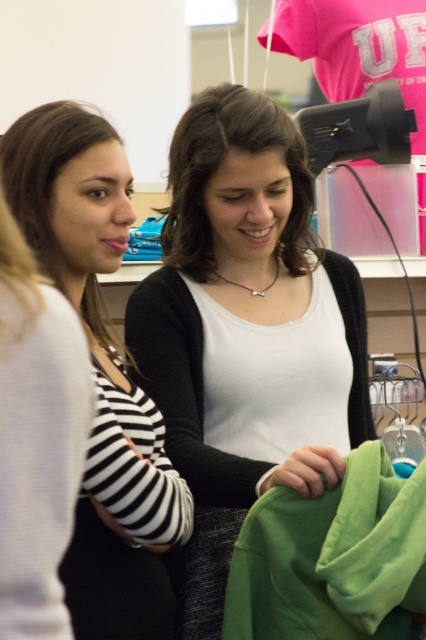
Does matte black striped shirt at left have a greater height compared to brown smooth hair at left?

Indeed, matte black striped shirt at left has a greater height compared to brown smooth hair at left.

Which is in front, point (164, 582) or point (34, 243)?

Point (34, 243) is more forward.

In order to click on matte black striped shirt at left in this screenshot , I will do tap(100, 372).

In the scene shown: Does green cotton shirt at lower right have a lesser height compared to matte black shirt at left?

Yes, green cotton shirt at lower right is shorter than matte black shirt at left.

In the scene shown: Is green cotton shirt at lower right thinner than matte black shirt at left?

No, green cotton shirt at lower right is not thinner than matte black shirt at left.

The height and width of the screenshot is (640, 426). I want to click on green cotton shirt at lower right, so click(x=333, y=557).

Where is `green cotton shirt at lower right`? The height and width of the screenshot is (640, 426). green cotton shirt at lower right is located at coordinates (333, 557).

Is white matte shirt at center positioned before brown smooth hair at center?

Yes.

Can you confirm if white matte shirt at center is bigger than brown smooth hair at center?

Yes, white matte shirt at center is bigger than brown smooth hair at center.

Which is in front, point (298, 211) or point (187, 204)?

Positioned in front is point (187, 204).

The width and height of the screenshot is (426, 640). In order to click on white matte shirt at center in this screenshot , I will do `click(247, 324)`.